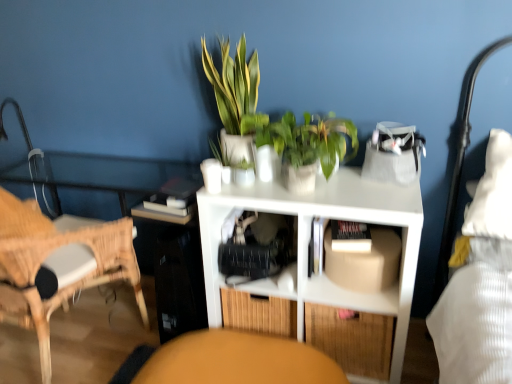
Question: From the image's perspective, relative to white matte shelf at center, positioned as the first shelf in bottom-to-top order, is green leafy plant at upper center, the 1th houseplant in the left-to-right sequence, above or below?

Choices:
 (A) above
 (B) below

Answer: (A)

Question: Relative to white matte shelf at center, positioned as the first shelf in bottom-to-top order, is green leafy plant at upper center, marked as the 2th houseplant in a right-to-left arrangement, in front or behind?

Choices:
 (A) front
 (B) behind

Answer: (B)

Question: Estimate the real-world distances between objects in this image. Which object is farther from the white matte shelf at center, the 2th shelf positioned from the top?

Choices:
 (A) bamboo drawer at lower center
 (B) green leafy plant at upper center, marked as the 2th houseplant in a right-to-left arrangement
 (C) matte orange swivel chair at lower center
 (D) green glossy plant at center, the first houseplant in the right-to-left sequence
 (E) translucent plastic shelf at center, the second shelf positioned from the bottom

Answer: (B)

Question: Which object is the closest to the white matte book at center?

Choices:
 (A) woven wood chair at left
 (B) white matte shelf at center, the 2th shelf positioned from the top
 (C) green leafy plant at upper center, marked as the 2th houseplant in a right-to-left arrangement
 (D) green glossy plant at center, acting as the 2th houseplant starting from the left
 (E) bamboo drawer at lower center

Answer: (B)